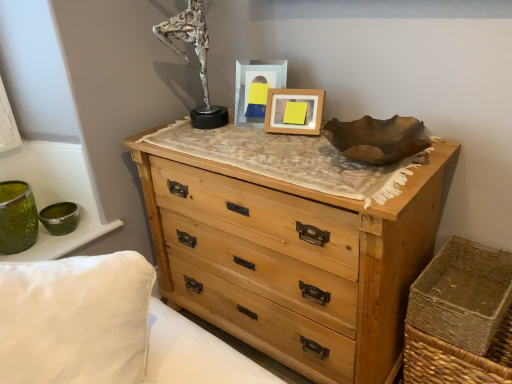
Where is `free location in front of matte plastic picture frame at center, which is counted as the 1th picture frame, starting from the left`? This screenshot has width=512, height=384. free location in front of matte plastic picture frame at center, which is counted as the 1th picture frame, starting from the left is located at coordinates (257, 127).